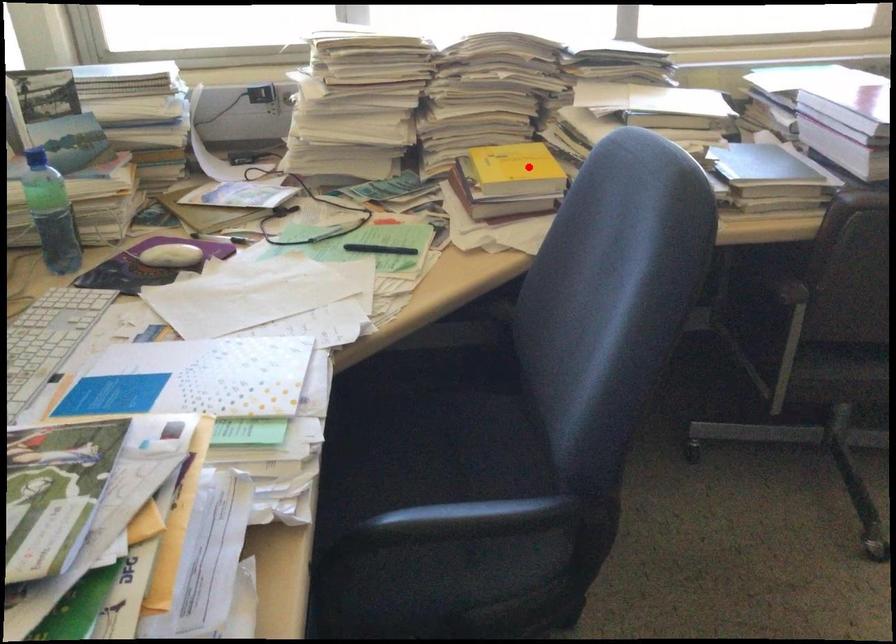
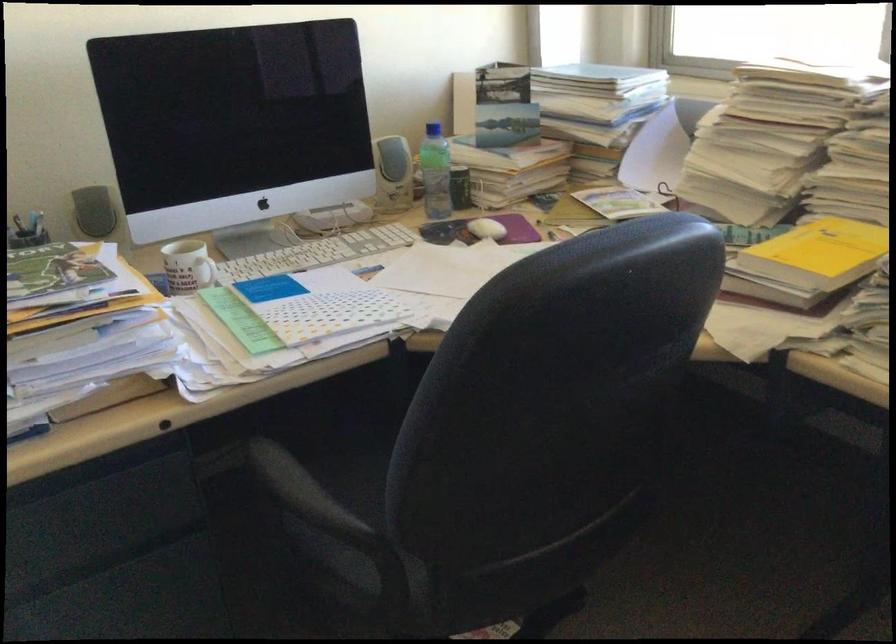
Find the pixel in the second image that matches the highlighted location in the first image.

(819, 252)